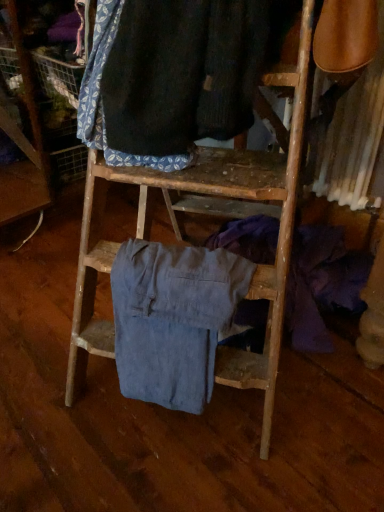
Question: Considering the relative sizes of denim pants at center, positioned as the second clothing in top-to-bottom order, and dark blue fabric at upper center, which appears as the 1th clothing when viewed from the top, in the image provided, is denim pants at center, positioned as the second clothing in top-to-bottom order, taller than dark blue fabric at upper center, which appears as the 1th clothing when viewed from the top,?

Choices:
 (A) yes
 (B) no

Answer: (A)

Question: Is denim pants at center, the first clothing in the bottom-to-top sequence, closer to camera compared to dark blue fabric at upper center, marked as the 2th clothing in a bottom-to-top arrangement?

Choices:
 (A) no
 (B) yes

Answer: (A)

Question: Can you confirm if denim pants at center, positioned as the second clothing in top-to-bottom order, is wider than dark blue fabric at upper center, which appears as the 1th clothing when viewed from the top?

Choices:
 (A) no
 (B) yes

Answer: (A)

Question: Is denim pants at center, the first clothing in the bottom-to-top sequence, not close to dark blue fabric at upper center, marked as the 2th clothing in a bottom-to-top arrangement?

Choices:
 (A) yes
 (B) no

Answer: (B)

Question: Can you confirm if denim pants at center, the first clothing in the bottom-to-top sequence, is shorter than dark blue fabric at upper center, marked as the 2th clothing in a bottom-to-top arrangement?

Choices:
 (A) no
 (B) yes

Answer: (A)

Question: From the image's perspective, is denim pants at center, the first clothing in the bottom-to-top sequence, below dark blue fabric at upper center, marked as the 2th clothing in a bottom-to-top arrangement?

Choices:
 (A) yes
 (B) no

Answer: (A)

Question: From a real-world perspective, does dark blue fabric at upper center, which appears as the 1th clothing when viewed from the top, stand above denim pants at center, positioned as the second clothing in top-to-bottom order?

Choices:
 (A) yes
 (B) no

Answer: (A)

Question: Is dark blue fabric at upper center, marked as the 2th clothing in a bottom-to-top arrangement, thinner than denim pants at center, positioned as the second clothing in top-to-bottom order?

Choices:
 (A) no
 (B) yes

Answer: (A)

Question: Would you say dark blue fabric at upper center, which appears as the 1th clothing when viewed from the top, contains denim pants at center, the first clothing in the bottom-to-top sequence?

Choices:
 (A) yes
 (B) no

Answer: (B)

Question: Is dark blue fabric at upper center, marked as the 2th clothing in a bottom-to-top arrangement, with denim pants at center, positioned as the second clothing in top-to-bottom order?

Choices:
 (A) no
 (B) yes

Answer: (A)

Question: Is dark blue fabric at upper center, which appears as the 1th clothing when viewed from the top, positioned in front of denim pants at center, positioned as the second clothing in top-to-bottom order?

Choices:
 (A) no
 (B) yes

Answer: (B)

Question: Is dark blue fabric at upper center, which appears as the 1th clothing when viewed from the top, wider than denim pants at center, positioned as the second clothing in top-to-bottom order?

Choices:
 (A) yes
 (B) no

Answer: (A)

Question: Is dark blue fabric at upper center, marked as the 2th clothing in a bottom-to-top arrangement, wider or thinner than denim pants at center, positioned as the second clothing in top-to-bottom order?

Choices:
 (A) thin
 (B) wide

Answer: (B)